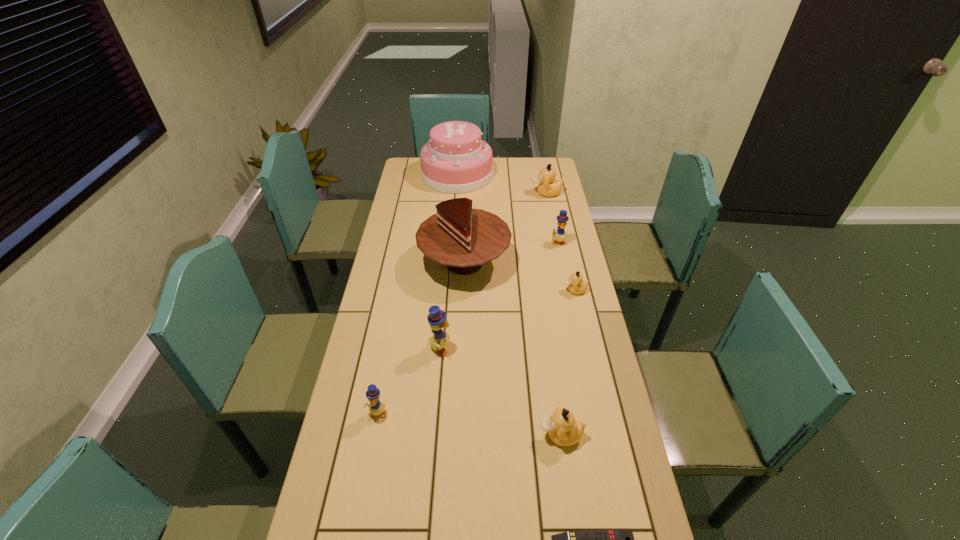
Image resolution: width=960 pixels, height=540 pixels. In order to click on tan duckling that is the second closest one to the shortest object in this screenshot , I will do `click(576, 285)`.